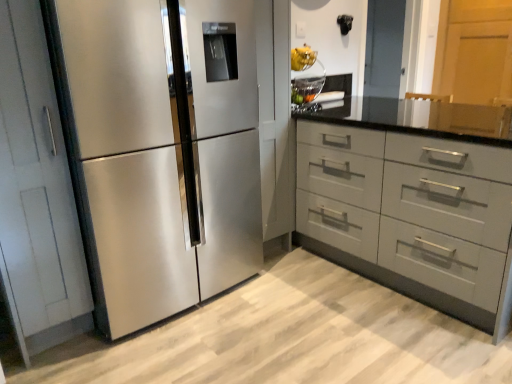
Question: From the image's perspective, is matte gray drawers at center-right on top of stainless steel refrigerator at left?

Choices:
 (A) yes
 (B) no

Answer: (B)

Question: Is matte gray drawers at center-right oriented towards stainless steel refrigerator at left?

Choices:
 (A) yes
 (B) no

Answer: (A)

Question: Is matte gray drawers at center-right positioned with its back to stainless steel refrigerator at left?

Choices:
 (A) yes
 (B) no

Answer: (B)

Question: Can you confirm if matte gray drawers at center-right is thinner than stainless steel refrigerator at left?

Choices:
 (A) yes
 (B) no

Answer: (B)

Question: Considering the relative sizes of matte gray drawers at center-right and stainless steel refrigerator at left in the image provided, is matte gray drawers at center-right smaller than stainless steel refrigerator at left?

Choices:
 (A) yes
 (B) no

Answer: (B)

Question: From the image's perspective, does matte gray drawers at center-right appear lower than stainless steel refrigerator at left?

Choices:
 (A) no
 (B) yes

Answer: (B)

Question: Is stainless steel refrigerator at left facing away from matte gray drawers at center-right?

Choices:
 (A) yes
 (B) no

Answer: (B)

Question: Can you confirm if stainless steel refrigerator at left is thinner than matte gray drawers at center-right?

Choices:
 (A) no
 (B) yes

Answer: (B)

Question: Does stainless steel refrigerator at left turn towards matte gray drawers at center-right?

Choices:
 (A) no
 (B) yes

Answer: (A)

Question: Does stainless steel refrigerator at left touch matte gray drawers at center-right?

Choices:
 (A) yes
 (B) no

Answer: (B)

Question: From the image's perspective, is stainless steel refrigerator at left on matte gray drawers at center-right?

Choices:
 (A) no
 (B) yes

Answer: (B)

Question: Does stainless steel refrigerator at left have a lesser height compared to matte gray drawers at center-right?

Choices:
 (A) yes
 (B) no

Answer: (B)

Question: Which is correct: matte gray drawers at center-right is inside stainless steel refrigerator at left, or outside of it?

Choices:
 (A) inside
 (B) outside

Answer: (B)